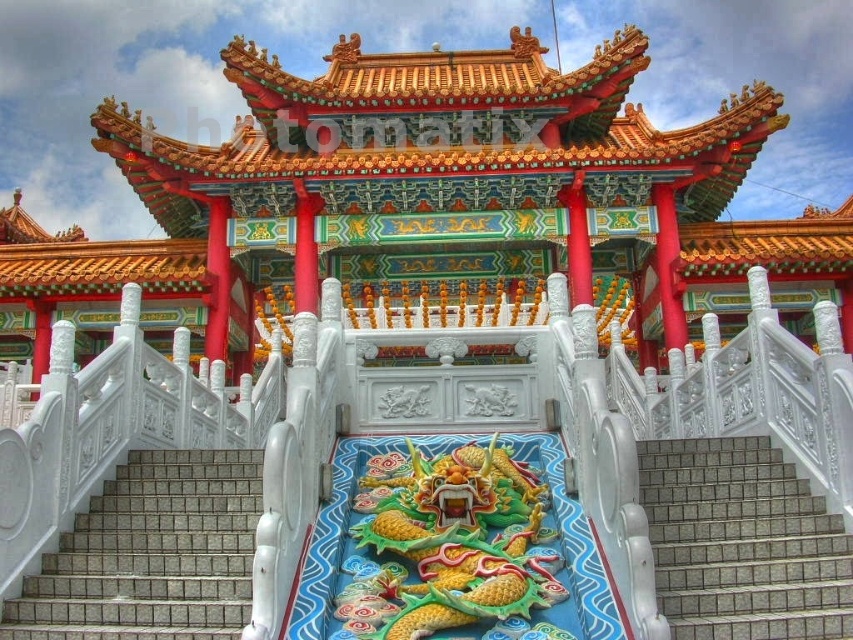
Question: Which object appears farthest from the camera in this image?

Choices:
 (A) white tile stairs at center
 (B) gray tile stairs at center

Answer: (A)

Question: Is white tile stairs at center behind gray tile stairs at center?

Choices:
 (A) yes
 (B) no

Answer: (A)

Question: Which point appears farthest from the camera in this image?

Choices:
 (A) (693, 541)
 (B) (148, 525)

Answer: (B)

Question: Is white tile stairs at center to the left of gray tile stairs at center from the viewer's perspective?

Choices:
 (A) no
 (B) yes

Answer: (B)

Question: Does white tile stairs at center appear under gray tile stairs at center?

Choices:
 (A) yes
 (B) no

Answer: (A)